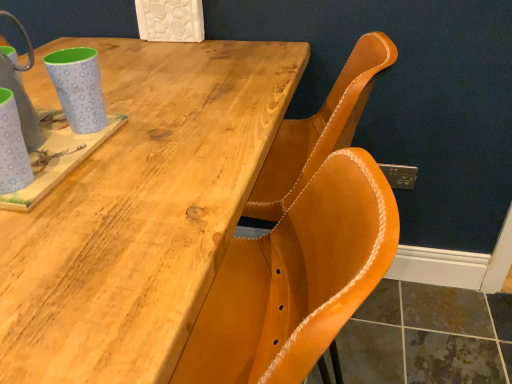
Question: From a real-world perspective, is light blue polka dot mug at upper left, placed as the first mug when sorted from back to front, physically located above or below natural wood table at upper left?

Choices:
 (A) below
 (B) above

Answer: (B)

Question: Considering the positions of light blue polka dot mug at upper left, placed as the first mug when sorted from back to front, and natural wood table at upper left in the image, is light blue polka dot mug at upper left, placed as the first mug when sorted from back to front, bigger or smaller than natural wood table at upper left?

Choices:
 (A) small
 (B) big

Answer: (A)

Question: Which of these objects is positioned closest to the matte blue cup at left, which is the 2th mug from back to front?

Choices:
 (A) natural wood table at upper left
 (B) light blue polka dot mug at upper left, which ranks as the 2th mug in front-to-back order

Answer: (B)

Question: Based on their relative distances, which object is farther from the light blue polka dot mug at upper left, which ranks as the 2th mug in front-to-back order?

Choices:
 (A) natural wood table at upper left
 (B) matte blue cup at left, which is the 2th mug from back to front

Answer: (A)